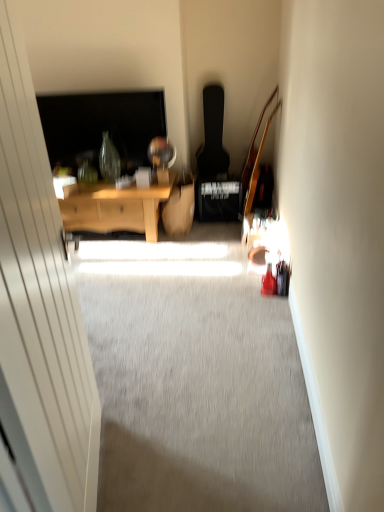
You are a GUI agent. You are given a task and a screenshot of the screen. Output one action in this format:
    pyautogui.click(x=<x>, y=<y>)
    Task: Click on the vacant space in front of wooden desk at center
    The image size is (384, 512).
    Given the screenshot: What is the action you would take?
    pyautogui.click(x=153, y=258)